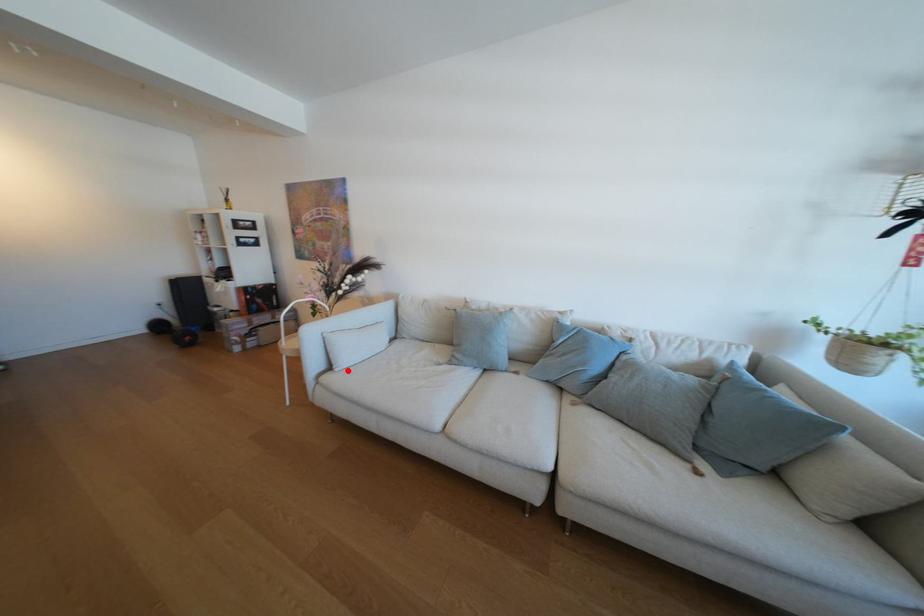
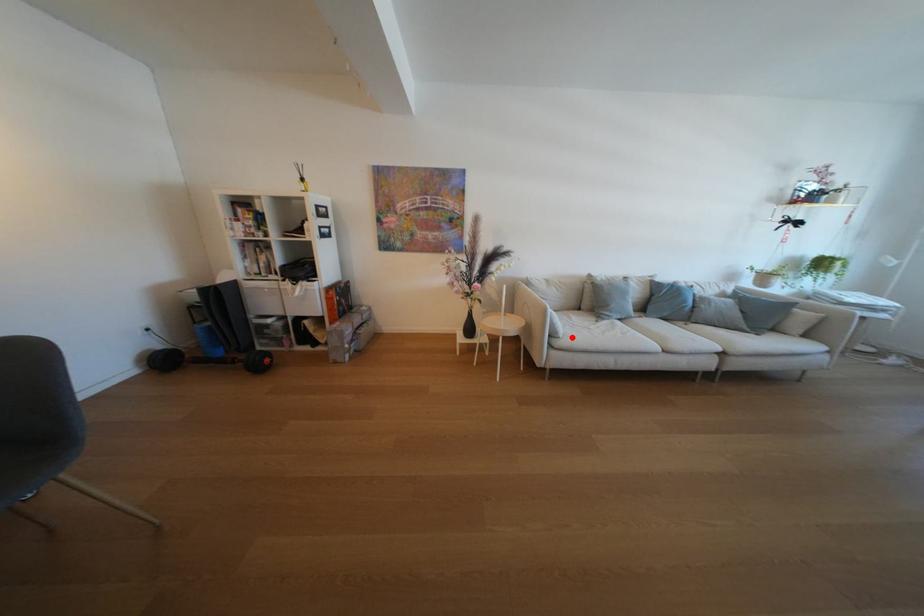
I am providing you with two images of the same scene from different viewpoints. A red point is marked on the first image and another point is marked on the second image. Do the highlighted points in image1 and image2 indicate the same real-world spot?

Yes